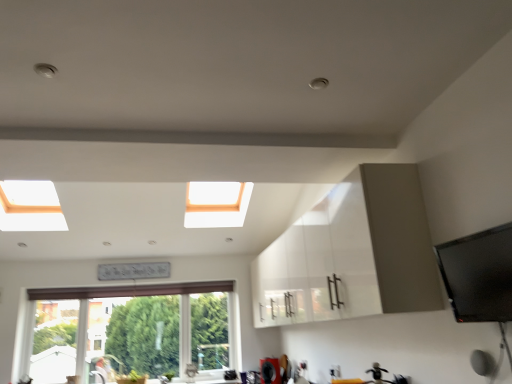
Question: Is point (162, 375) positioned closer to the camera than point (102, 296)?

Choices:
 (A) closer
 (B) farther

Answer: (B)

Question: From the image's perspective, is matte silver faucet at lower center located above or below white frame window at lower left?

Choices:
 (A) above
 (B) below

Answer: (B)

Question: Estimate the real-world distances between objects in this image. Which object is closer to the white frame window at lower left?

Choices:
 (A) matte silver faucet at lower center
 (B) white glossy cabinet at center

Answer: (A)

Question: Considering the real-world distances, which object is closest to the white glossy cabinet at center?

Choices:
 (A) matte silver faucet at lower center
 (B) white frame window at lower left

Answer: (B)